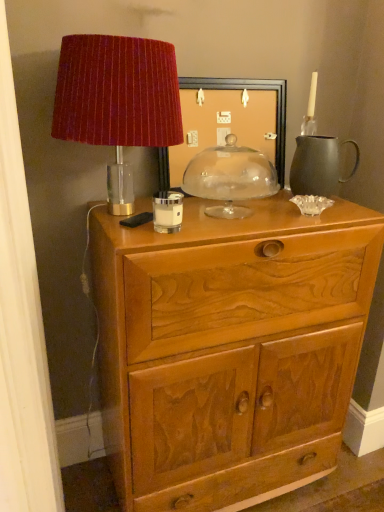
Where is `free space to the right of white glass candle holder at center, marked as the first candle holder in a left-to-right arrangement`? The width and height of the screenshot is (384, 512). free space to the right of white glass candle holder at center, marked as the first candle holder in a left-to-right arrangement is located at coordinates (228, 222).